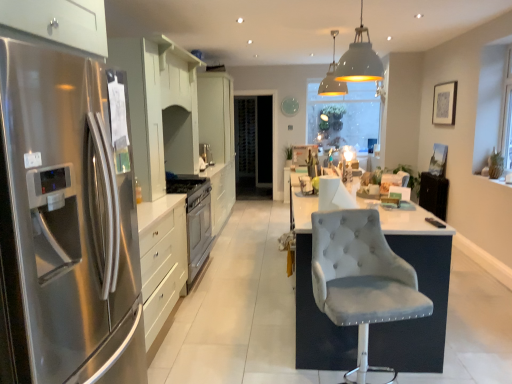
At what (x,y) coordinates should I click in order to perform the action: click on white glossy cabinets at center. Please return your answer as a coordinate pair (x, y). Looking at the image, I should click on (218, 141).

Describe the element at coordinates (359, 59) in the screenshot. The image size is (512, 384). I see `white matte pendant lamp at upper center, marked as the 2th light fixture in a back-to-front arrangement` at that location.

Looking at this image, measure the distance between point (332, 80) and camera.

Point (332, 80) and camera are 5.20 meters apart from each other.

The height and width of the screenshot is (384, 512). In order to click on velvet grey chair at center in this screenshot , I will do `click(370, 294)`.

What is the approximate width of transparent glass window screen at center?

9.17 centimeters.

Measure the distance between point (x=376, y=139) and camera.

They are 7.21 meters apart.

Locate an element on the screen. white glossy cabinets at center is located at coordinates (218, 141).

From a real-world perspective, is white matte pendant lamp at upper center, the first light fixture positioned from the front, positioned under satin silver oven at center based on gravity?

No, from a real-world perspective, white matte pendant lamp at upper center, the first light fixture positioned from the front, is not below satin silver oven at center.

Who is shorter, white matte pendant lamp at upper center, marked as the 2th light fixture in a back-to-front arrangement, or satin silver oven at center?

With less height is satin silver oven at center.

Which is more to the left, white matte pendant lamp at upper center, the first light fixture positioned from the front, or satin silver oven at center?

satin silver oven at center.

Is white matte pendant lamp at upper center, marked as the 2th light fixture in a back-to-front arrangement, facing away from satin silver oven at center?

No.

From the image's perspective, which one is positioned higher, white matte pendant lamp at upper center, the first light fixture positioned from the front, or matte white pendant lamp at upper center, the 1th light fixture when ordered from back to front?

From the image's view, matte white pendant lamp at upper center, the 1th light fixture when ordered from back to front, is above.

From a real-world perspective, between white matte pendant lamp at upper center, marked as the 2th light fixture in a back-to-front arrangement, and matte white pendant lamp at upper center, the 2th light fixture positioned from the front, who is vertically lower?

In real-world perspective, white matte pendant lamp at upper center, marked as the 2th light fixture in a back-to-front arrangement, is lower.

Considering the relative positions of white matte pendant lamp at upper center, marked as the 2th light fixture in a back-to-front arrangement, and matte white pendant lamp at upper center, the 2th light fixture positioned from the front, in the image provided, is white matte pendant lamp at upper center, marked as the 2th light fixture in a back-to-front arrangement, to the right of matte white pendant lamp at upper center, the 2th light fixture positioned from the front, from the viewer's perspective?

No, white matte pendant lamp at upper center, marked as the 2th light fixture in a back-to-front arrangement, is not to the right of matte white pendant lamp at upper center, the 2th light fixture positioned from the front.

Does point (368, 38) come in front of point (334, 59)?

Yes, it is.

Considering the positions of objects matte white pendant lamp at upper center, the 1th light fixture when ordered from back to front, and velvet grey chair at center in the image provided, who is more to the right, matte white pendant lamp at upper center, the 1th light fixture when ordered from back to front, or velvet grey chair at center?

matte white pendant lamp at upper center, the 1th light fixture when ordered from back to front, is more to the right.

How many degrees apart are the facing directions of matte white pendant lamp at upper center, the 1th light fixture when ordered from back to front, and velvet grey chair at center?

13 degrees.

This screenshot has width=512, height=384. Identify the location of chair lying below the matte white pendant lamp at upper center, the 2th light fixture positioned from the front (from the image's perspective). (370, 294).

Is matte white pendant lamp at upper center, the 1th light fixture when ordered from back to front, inside the boundaries of velvet grey chair at center, or outside?

matte white pendant lamp at upper center, the 1th light fixture when ordered from back to front, is spatially situated outside velvet grey chair at center.

Is velvet grey chair at center smaller than white matte pendant lamp at upper center, the first light fixture positioned from the front?

No.

Is velvet grey chair at center in contact with white matte pendant lamp at upper center, marked as the 2th light fixture in a back-to-front arrangement?

velvet grey chair at center is not next to white matte pendant lamp at upper center, marked as the 2th light fixture in a back-to-front arrangement, and they're not touching.

In terms of width, does velvet grey chair at center look wider or thinner when compared to white matte pendant lamp at upper center, marked as the 2th light fixture in a back-to-front arrangement?

Clearly, velvet grey chair at center has more width compared to white matte pendant lamp at upper center, marked as the 2th light fixture in a back-to-front arrangement.

Does velvet grey chair at center have a greater height compared to white matte pendant lamp at upper center, marked as the 2th light fixture in a back-to-front arrangement?

Indeed, velvet grey chair at center has a greater height compared to white matte pendant lamp at upper center, marked as the 2th light fixture in a back-to-front arrangement.

Is matte white pendant lamp at upper center, the 2th light fixture positioned from the front, further to the viewer compared to transparent glass window screen at center?

No, matte white pendant lamp at upper center, the 2th light fixture positioned from the front, is closer to the camera.

Is matte white pendant lamp at upper center, the 1th light fixture when ordered from back to front, at the right side of transparent glass window screen at center?

No.

Is matte white pendant lamp at upper center, the 1th light fixture when ordered from back to front, far from transparent glass window screen at center?

Yes, matte white pendant lamp at upper center, the 1th light fixture when ordered from back to front, and transparent glass window screen at center are located far from each other.

Is matte white pendant lamp at upper center, the 2th light fixture positioned from the front, looking in the opposite direction of transparent glass window screen at center?

Yes, matte white pendant lamp at upper center, the 2th light fixture positioned from the front, is facing away from transparent glass window screen at center.

Is stainless steel refrigerator at left inside or outside of transparent glass window screen at center?

stainless steel refrigerator at left cannot be found inside transparent glass window screen at center.

From the image's perspective, is stainless steel refrigerator at left over transparent glass window screen at center?

No.

Between point (74, 284) and point (343, 120), which one is positioned behind?

The point (343, 120) is more distant.

Is stainless steel refrigerator at left directly adjacent to transparent glass window screen at center?

No, stainless steel refrigerator at left is not in contact with transparent glass window screen at center.

Which of these two, stainless steel refrigerator at left or velvet grey chair at center, is thinner?

With smaller width is velvet grey chair at center.

From a real-world perspective, which object stands above the other?

From a 3D spatial view, stainless steel refrigerator at left is above.

Is stainless steel refrigerator at left touching velvet grey chair at center?

No, stainless steel refrigerator at left is not beside velvet grey chair at center.

Considering the relative sizes of stainless steel refrigerator at left and velvet grey chair at center in the image provided, is stainless steel refrigerator at left smaller than velvet grey chair at center?

Actually, stainless steel refrigerator at left might be larger than velvet grey chair at center.

The image size is (512, 384). Find the location of `appliance below the white matte pendant lamp at upper center, the first light fixture positioned from the front (from a real-world perspective)`. appliance below the white matte pendant lamp at upper center, the first light fixture positioned from the front (from a real-world perspective) is located at coordinates (206, 153).

Image resolution: width=512 pixels, height=384 pixels. In order to click on light fixture below the matte white pendant lamp at upper center, the 2th light fixture positioned from the front (from the image's perspective) in this screenshot , I will do `click(359, 59)`.

When comparing their distances from transparent glass window screen at center, does matte white pendant lamp at upper center, the 1th light fixture when ordered from back to front, or velvet grey chair at center seem further?

The object further to transparent glass window screen at center is velvet grey chair at center.

From the image, which object appears to be farther from white glossy cabinets at center, stainless steel refrigerator at left or transparent glass door at center?

The object further to white glossy cabinets at center is stainless steel refrigerator at left.

Considering their positions, is transparent glass window screen at center positioned further to satin silver oven at center than white glossy cabinets at center?

The object further to satin silver oven at center is transparent glass window screen at center.

Based on the photo, which object lies nearer to the anchor point transparent glass door at center, white glossy cabinets at center or transparent glass window screen at center?

The object closer to transparent glass door at center is transparent glass window screen at center.

Based on their spatial positions, is white matte pendant lamp at upper center, the first light fixture positioned from the front, or white glossy cabinets at center closer to stainless steel refrigerator at left?

Among the two, white matte pendant lamp at upper center, the first light fixture positioned from the front, is located nearer to stainless steel refrigerator at left.

Which object lies further to the anchor point matte white pendant lamp at upper center, the 1th light fixture when ordered from back to front, transparent glass door at center or stainless steel refrigerator at left?

stainless steel refrigerator at left is positioned further to the anchor matte white pendant lamp at upper center, the 1th light fixture when ordered from back to front.

Based on their spatial positions, is satin silver oven at center or white matte pendant lamp at upper center, marked as the 2th light fixture in a back-to-front arrangement, closer to stainless steel refrigerator at left?

white matte pendant lamp at upper center, marked as the 2th light fixture in a back-to-front arrangement, is closer to stainless steel refrigerator at left.

Estimate the real-world distances between objects in this image. Which object is further from stainless steel refrigerator at left, transparent glass door at center or transparent glass window screen at center?

The object further to stainless steel refrigerator at left is transparent glass door at center.

Locate an element on the screen. cabinetry between white matte pendant lamp at upper center, the first light fixture positioned from the front, and transparent glass window screen at center from front to back is located at coordinates (218, 141).

Locate an element on the screen. The height and width of the screenshot is (384, 512). appliance between velvet grey chair at center and transparent glass door at center along the z-axis is located at coordinates (206, 153).

Identify the location of glass door between matte white pendant lamp at upper center, the 1th light fixture when ordered from back to front, and transparent glass window screen at center from front to back. The width and height of the screenshot is (512, 384). (254, 144).

The height and width of the screenshot is (384, 512). I want to click on glass door between white glossy cabinets at center and transparent glass window screen at center, so click(x=254, y=144).